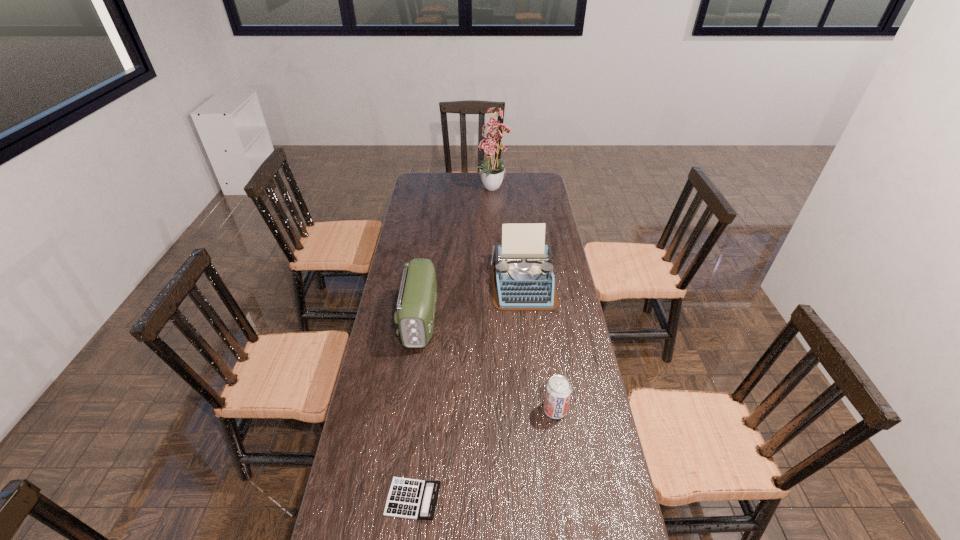
Locate an element on the screen. The height and width of the screenshot is (540, 960). flower arrangement is located at coordinates (492, 174).

Where is `the farthest object`? the farthest object is located at coordinates (492, 174).

The image size is (960, 540). I want to click on typewriter, so click(x=522, y=275).

Identify the location of radio_receiver. (416, 304).

This screenshot has height=540, width=960. In order to click on the second nearest object in this screenshot , I will do `click(558, 390)`.

You are a GUI agent. You are given a task and a screenshot of the screen. Output one action in this format:
    pyautogui.click(x=<x>, y=<y>)
    Task: Click on the fourth tallest object
    This screenshot has height=540, width=960.
    Given the screenshot: What is the action you would take?
    pyautogui.click(x=558, y=390)

You are a GUI agent. You are given a task and a screenshot of the screen. Output one action in this format:
    pyautogui.click(x=<x>, y=<y>)
    Task: Click on the nearest object
    The height and width of the screenshot is (540, 960).
    Given the screenshot: What is the action you would take?
    pyautogui.click(x=408, y=498)

I want to click on calculator, so click(408, 498).

This screenshot has height=540, width=960. Find the location of `vacant area situated on the front-facing side of the farthest object`. vacant area situated on the front-facing side of the farthest object is located at coordinates (496, 241).

This screenshot has height=540, width=960. In order to click on free space located on the typing side of the typewriter in this screenshot , I will do `click(527, 322)`.